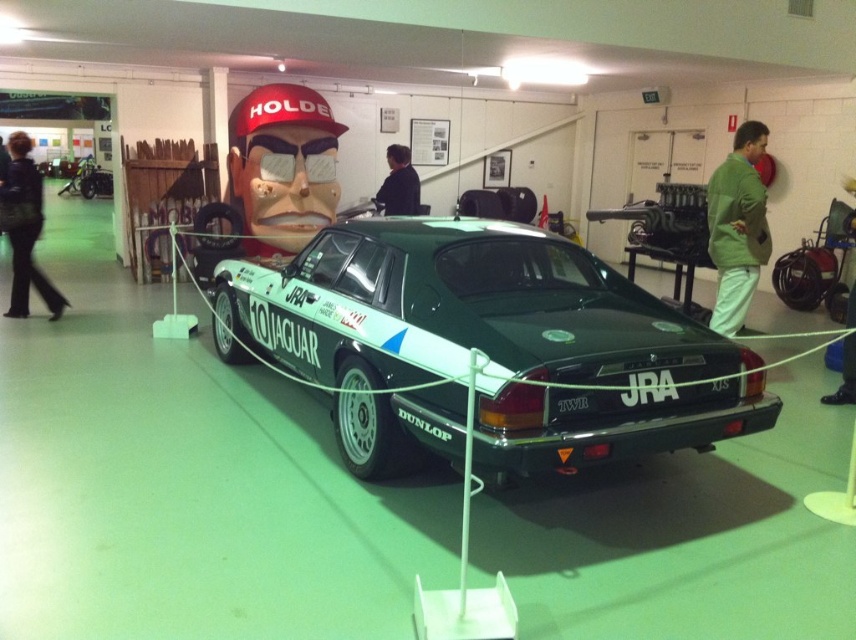
Which of these two, green cotton jacket at right or black leather jacket at left, stands taller?

Standing taller between the two is green cotton jacket at right.

Can you confirm if green cotton jacket at right is smaller than black leather jacket at left?

No.

Is point (732, 298) less distant than point (21, 227)?

Yes, point (732, 298) is in front of point (21, 227).

Locate an element on the screen. Image resolution: width=856 pixels, height=640 pixels. green cotton jacket at right is located at coordinates tap(736, 227).

Does black leather jacket at center have a smaller size compared to green fabric pants at lower right?

No, black leather jacket at center is not smaller than green fabric pants at lower right.

Which is behind, point (381, 193) or point (853, 397)?

The point (381, 193) is behind.

Does point (400, 172) lie in front of point (842, 186)?

Yes, point (400, 172) is closer to viewer.

Locate an element on the screen. black leather jacket at center is located at coordinates (399, 182).

Can you confirm if green cotton jacket at right is bigger than green fabric pants at lower right?

Yes, green cotton jacket at right is bigger than green fabric pants at lower right.

Who is higher up, green cotton jacket at right or green fabric pants at lower right?

green cotton jacket at right is above.

Who is more forward, (746, 154) or (851, 289)?

Point (746, 154) is in front.

Locate an element on the screen. green cotton jacket at right is located at coordinates (736, 227).